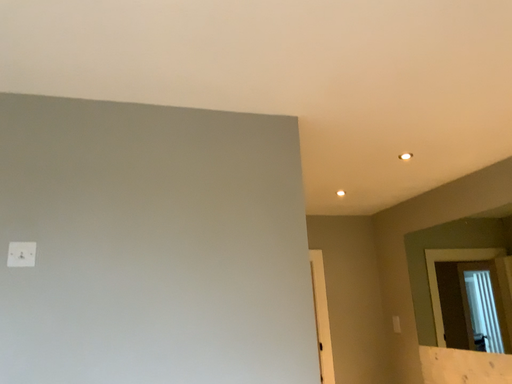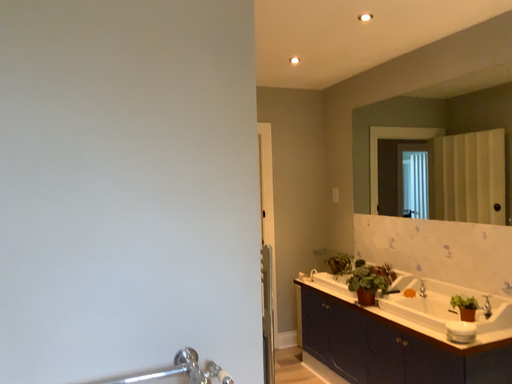
Question: Which way did the camera rotate in the video?

Choices:
 (A) rotated left
 (B) rotated right

Answer: (B)